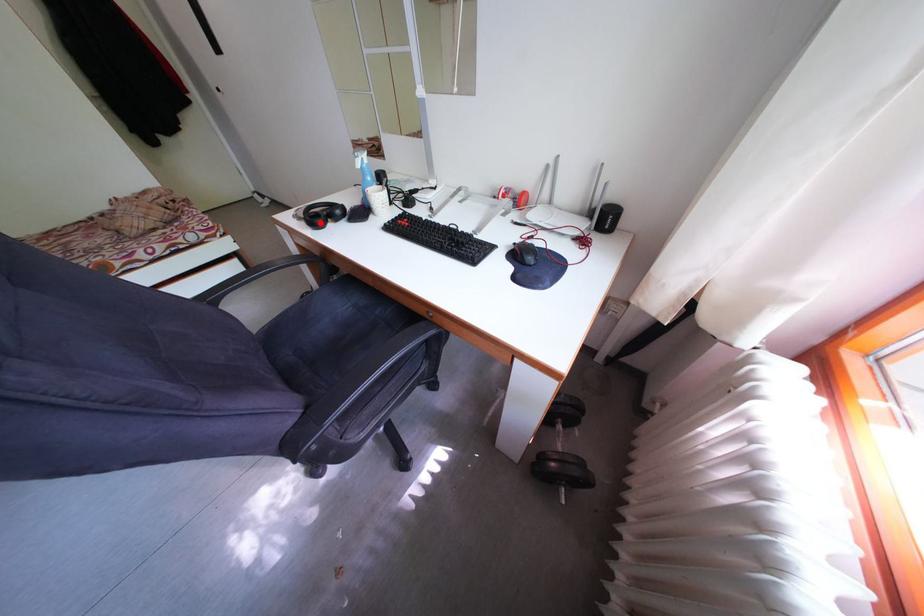
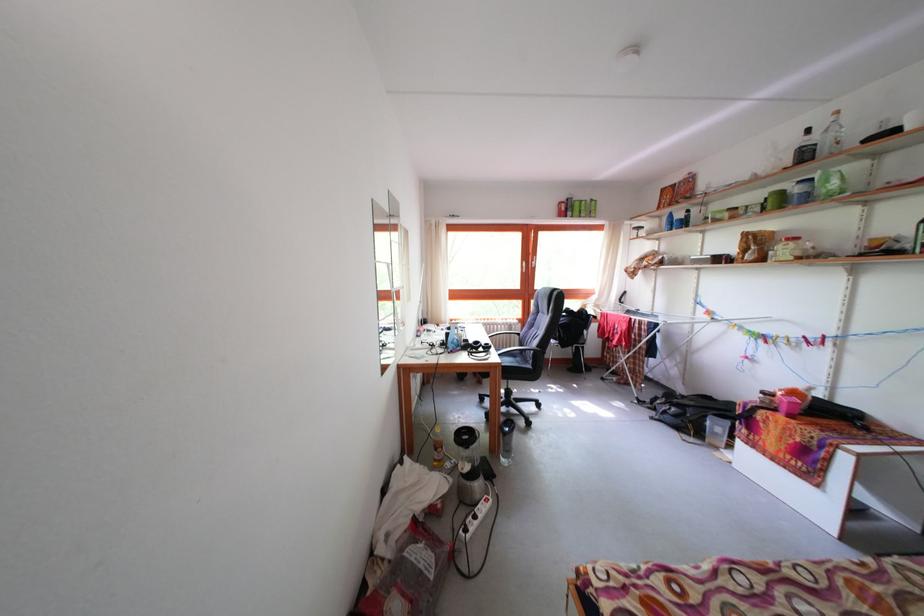
Question: I am providing you with two images of the same scene from different viewpoints. A red point is marked on the first image. Can you still see the location of the red point in image 2?

Choices:
 (A) Yes
 (B) No

Answer: (B)